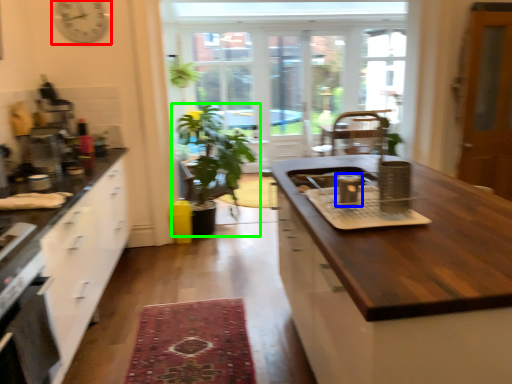
Question: Which object is the closest to the clock (highlighted by a red box)? Choose among these: appliance (highlighted by a blue box) or houseplant (highlighted by a green box).

Choices:
 (A) appliance
 (B) houseplant

Answer: (B)